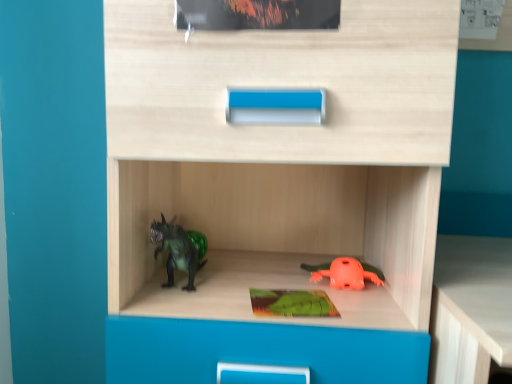
What is the approximate height of green matte dinosaur at left, acting as the first toy starting from the left?

green matte dinosaur at left, acting as the first toy starting from the left, is 5.80 inches tall.

The width and height of the screenshot is (512, 384). What do you see at coordinates (346, 274) in the screenshot? I see `orange matte frog at lower center, placed as the first toy when sorted from right to left` at bounding box center [346, 274].

Where is `green matte paperback book at center`? The image size is (512, 384). green matte paperback book at center is located at coordinates (291, 303).

Is orange matte frog at lower center, placed as the 2th toy when sorted from left to right, positioned with its back to green matte dinosaur at left, acting as the first toy starting from the left?

orange matte frog at lower center, placed as the 2th toy when sorted from left to right, is not turned away from green matte dinosaur at left, acting as the first toy starting from the left.

Can you confirm if orange matte frog at lower center, placed as the first toy when sorted from right to left, is thinner than green matte dinosaur at left, acting as the first toy starting from the left?

Indeed, orange matte frog at lower center, placed as the first toy when sorted from right to left, has a lesser width compared to green matte dinosaur at left, acting as the first toy starting from the left.

Is orange matte frog at lower center, placed as the 2th toy when sorted from left to right, beside green matte dinosaur at left, acting as the first toy starting from the left?

They are not placed beside each other.

Can you see green matte paperback book at center touching orange matte frog at lower center, placed as the 2th toy when sorted from left to right?

Indeed, green matte paperback book at center and orange matte frog at lower center, placed as the 2th toy when sorted from left to right, are beside each other and touching.

In the scene shown: Would you say green matte paperback book at center is outside orange matte frog at lower center, placed as the 2th toy when sorted from left to right?

Yes, green matte paperback book at center is located beyond the bounds of orange matte frog at lower center, placed as the 2th toy when sorted from left to right.

Is green matte paperback book at center wider or thinner than orange matte frog at lower center, placed as the first toy when sorted from right to left?

→ In the image, green matte paperback book at center appears to be more narrow than orange matte frog at lower center, placed as the first toy when sorted from right to left.

How far apart are green matte paperback book at center and orange matte frog at lower center, placed as the first toy when sorted from right to left?

9.86 centimeters.

From the image's perspective, is green matte paperback book at center on green matte dinosaur at left, positioned as the second toy in right-to-left order?

No, from the image's perspective, green matte paperback book at center is not on top of green matte dinosaur at left, positioned as the second toy in right-to-left order.

Are green matte paperback book at center and green matte dinosaur at left, positioned as the second toy in right-to-left order, located far from each other?

That's not correct — green matte paperback book at center is a little close to green matte dinosaur at left, positioned as the second toy in right-to-left order.

Can you confirm if green matte paperback book at center is wider than green matte dinosaur at left, positioned as the second toy in right-to-left order?

No.

From a real-world perspective, which is physically above, green matte dinosaur at left, positioned as the second toy in right-to-left order, or green matte paperback book at center?

From a 3D spatial view, green matte dinosaur at left, positioned as the second toy in right-to-left order, is above.

Between point (160, 227) and point (324, 313), which one is positioned behind?

The point (160, 227) is behind.

Considering the relative positions of green matte dinosaur at left, acting as the first toy starting from the left, and green matte paperback book at center in the image provided, is green matte dinosaur at left, acting as the first toy starting from the left, to the left of green matte paperback book at center from the viewer's perspective?

Indeed, green matte dinosaur at left, acting as the first toy starting from the left, is positioned on the left side of green matte paperback book at center.

From the picture: Which object is further away from the camera, green matte dinosaur at left, acting as the first toy starting from the left, or orange matte frog at lower center, placed as the first toy when sorted from right to left?

orange matte frog at lower center, placed as the first toy when sorted from right to left, is behind.

From the image's perspective, which is below, green matte dinosaur at left, acting as the first toy starting from the left, or orange matte frog at lower center, placed as the 2th toy when sorted from left to right?

orange matte frog at lower center, placed as the 2th toy when sorted from left to right, from the image's perspective.

Is green matte dinosaur at left, positioned as the second toy in right-to-left order, facing towards orange matte frog at lower center, placed as the first toy when sorted from right to left?

Answer: No, green matte dinosaur at left, positioned as the second toy in right-to-left order, is not turned towards orange matte frog at lower center, placed as the first toy when sorted from right to left.

Considering the relative sizes of green matte dinosaur at left, positioned as the second toy in right-to-left order, and orange matte frog at lower center, placed as the 2th toy when sorted from left to right, in the image provided, is green matte dinosaur at left, positioned as the second toy in right-to-left order, smaller than orange matte frog at lower center, placed as the 2th toy when sorted from left to right,?

No.

Considering the points (334, 288) and (327, 306), which point is behind, point (334, 288) or point (327, 306)?

Positioned behind is point (334, 288).

Between orange matte frog at lower center, placed as the first toy when sorted from right to left, and green matte paperback book at center, which one appears on the right side from the viewer's perspective?

From the viewer's perspective, orange matte frog at lower center, placed as the first toy when sorted from right to left, appears more on the right side.

Which of these two, orange matte frog at lower center, placed as the 2th toy when sorted from left to right, or green matte paperback book at center, stands taller?

orange matte frog at lower center, placed as the 2th toy when sorted from left to right.

Who is smaller, orange matte frog at lower center, placed as the 2th toy when sorted from left to right, or green matte paperback book at center?

Smaller between the two is green matte paperback book at center.

Where is `toy that appears above the orange matte frog at lower center, placed as the 2th toy when sorted from left to right (from a real-world perspective)`? toy that appears above the orange matte frog at lower center, placed as the 2th toy when sorted from left to right (from a real-world perspective) is located at coordinates (176, 250).

Find the location of a particular element. Image resolution: width=512 pixels, height=384 pixels. the 2nd toy behind the green matte paperback book at center is located at coordinates (346, 274).

Looking at this image, when comparing their distances from orange matte frog at lower center, placed as the 2th toy when sorted from left to right, does green matte dinosaur at left, acting as the first toy starting from the left, or green matte paperback book at center seem closer?

green matte paperback book at center is positioned closer to the anchor orange matte frog at lower center, placed as the 2th toy when sorted from left to right.

Looking at the image, which one is located closer to green matte paperback book at center, orange matte frog at lower center, placed as the 2th toy when sorted from left to right, or green matte dinosaur at left, acting as the first toy starting from the left?

The object closer to green matte paperback book at center is orange matte frog at lower center, placed as the 2th toy when sorted from left to right.

From the image, which object appears to be nearer to orange matte frog at lower center, placed as the 2th toy when sorted from left to right, green matte paperback book at center or green matte dinosaur at left, positioned as the second toy in right-to-left order?

The object closer to orange matte frog at lower center, placed as the 2th toy when sorted from left to right, is green matte paperback book at center.

Looking at the image, which one is located further to green matte paperback book at center, green matte dinosaur at left, positioned as the second toy in right-to-left order, or orange matte frog at lower center, placed as the first toy when sorted from right to left?

Among the two, green matte dinosaur at left, positioned as the second toy in right-to-left order, is located further to green matte paperback book at center.

When comparing their distances from green matte dinosaur at left, acting as the first toy starting from the left, does green matte paperback book at center or orange matte frog at lower center, placed as the 2th toy when sorted from left to right, seem closer?

Among the two, green matte paperback book at center is located nearer to green matte dinosaur at left, acting as the first toy starting from the left.

Looking at the image, which one is located closer to green matte dinosaur at left, positioned as the second toy in right-to-left order, orange matte frog at lower center, placed as the first toy when sorted from right to left, or green matte paperback book at center?

Among the two, green matte paperback book at center is located nearer to green matte dinosaur at left, positioned as the second toy in right-to-left order.

Locate an element on the screen. paperback book located between green matte dinosaur at left, positioned as the second toy in right-to-left order, and orange matte frog at lower center, placed as the 2th toy when sorted from left to right, in the left-right direction is located at coordinates (291, 303).